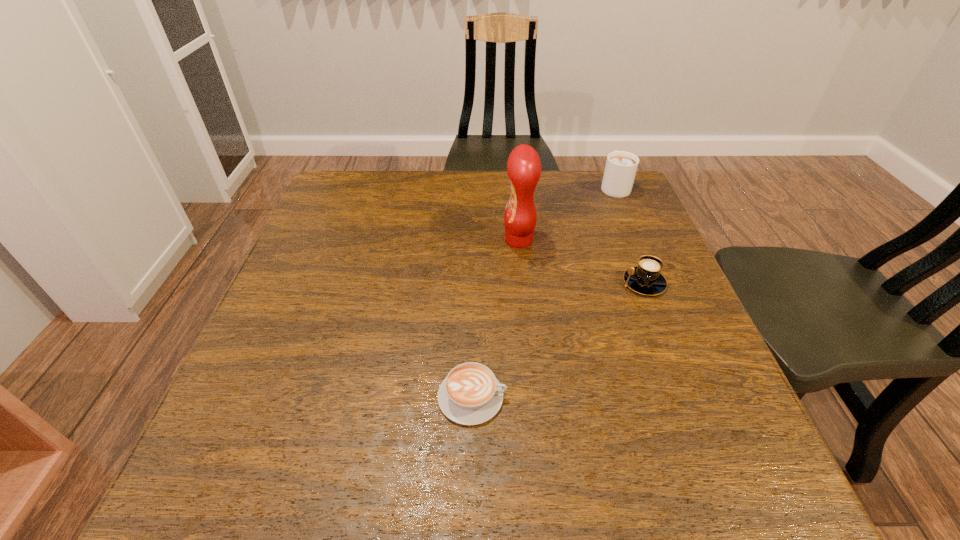
Locate an element on the screen. Image resolution: width=960 pixels, height=540 pixels. the second object from left to right is located at coordinates coord(523,166).

Where is `condiment`? The height and width of the screenshot is (540, 960). condiment is located at coordinates (523, 166).

Where is `the farthest cappuccino`? The image size is (960, 540). the farthest cappuccino is located at coordinates (621, 166).

Identify the location of the farthest object. pos(621,166).

Where is `the third tallest object`? the third tallest object is located at coordinates (646, 279).

At what (x,y) coordinates should I click in order to perform the action: click on the second shortest cappuccino. Please return your answer as a coordinate pair (x, y). Looking at the image, I should click on (646, 279).

You are a GUI agent. You are given a task and a screenshot of the screen. Output one action in this format:
    pyautogui.click(x=<x>, y=<y>)
    Task: Click on the shortest object
    This screenshot has height=540, width=960.
    Given the screenshot: What is the action you would take?
    pyautogui.click(x=470, y=394)

You are a GUI agent. You are given a task and a screenshot of the screen. Output one action in this format:
    pyautogui.click(x=<x>, y=<y>)
    Task: Click on the shortest cappuccino
    Image resolution: width=960 pixels, height=540 pixels.
    Given the screenshot: What is the action you would take?
    pyautogui.click(x=470, y=394)

Find the location of a particular element. This screenshot has width=960, height=540. vacant space located 0.120m on the label side of the condiment is located at coordinates (455, 240).

In order to click on free location located on the label side of the condiment in this screenshot , I will do `click(483, 240)`.